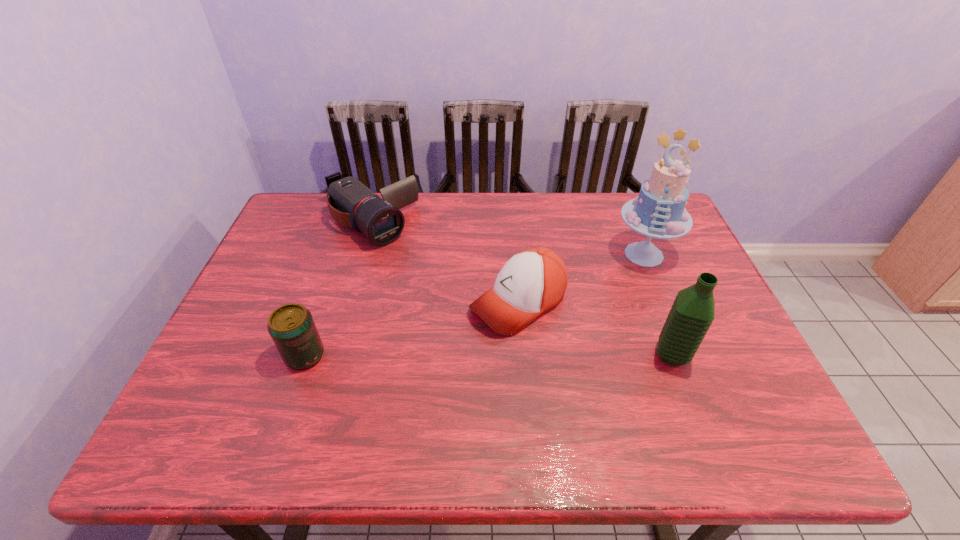
This screenshot has height=540, width=960. Find the location of `beer can`. beer can is located at coordinates (292, 328).

Locate an element on the screen. This screenshot has height=540, width=960. the second tallest object is located at coordinates (692, 313).

Image resolution: width=960 pixels, height=540 pixels. I want to click on the third object from right to left, so click(x=532, y=281).

You are a GUI agent. You are given a task and a screenshot of the screen. Output one action in this format:
    pyautogui.click(x=<x>, y=<y>)
    Task: Click on the camcorder
    The image size is (960, 540).
    Given the screenshot: What is the action you would take?
    pyautogui.click(x=351, y=203)

Find the location of `the tallest object`. the tallest object is located at coordinates (659, 212).

Find the location of a particular element. This screenshot has height=540, width=960. vacant space located 0.320m on the right of the beer can is located at coordinates (460, 356).

The image size is (960, 540). I want to click on blank space located 0.090m on the back of the second tallest object, so click(656, 313).

Where is `vacant space located on the front-facing side of the baseball cap`? vacant space located on the front-facing side of the baseball cap is located at coordinates (368, 397).

At what (x,y) coordinates should I click in order to perform the action: click on vacant point located on the front-facing side of the baseball cap. Please return your answer as a coordinate pair (x, y). The height and width of the screenshot is (540, 960). Looking at the image, I should click on (452, 343).

Where is `free spot located 0.210m on the front-facing side of the baseball cap`? free spot located 0.210m on the front-facing side of the baseball cap is located at coordinates [410, 370].